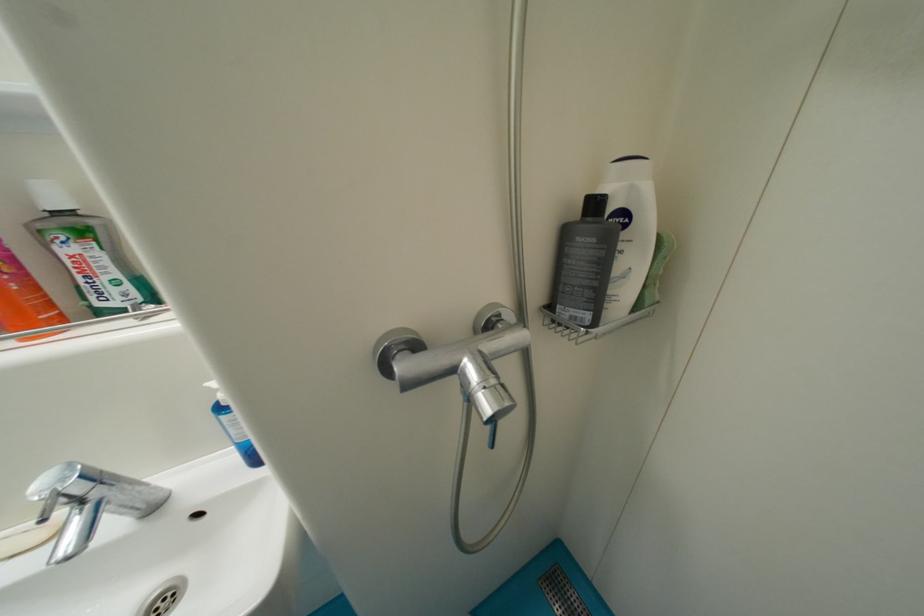
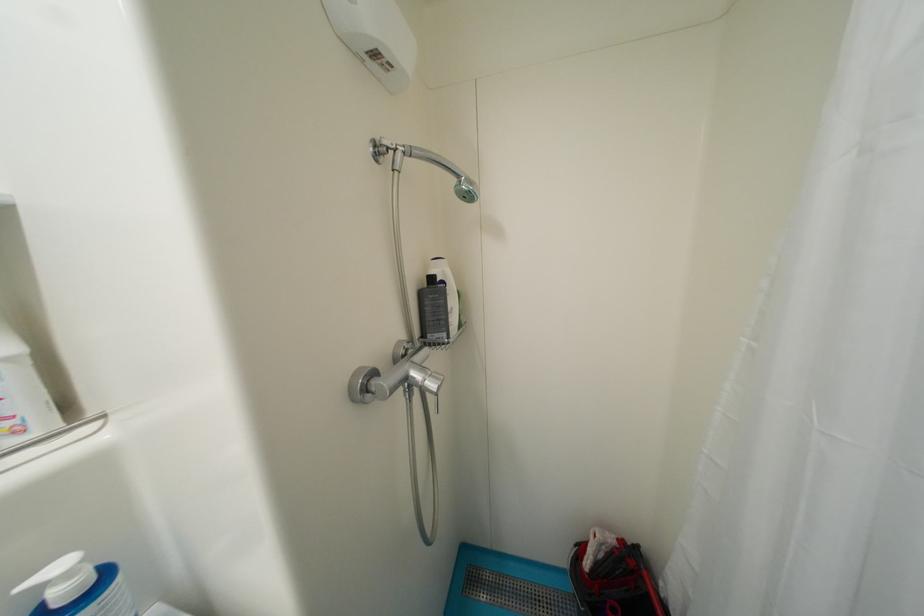
The point at (601, 206) is marked in the first image. Where is the corresponding point in the second image?

(439, 281)